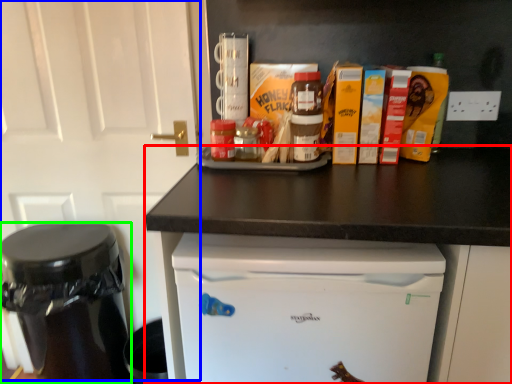
Question: Estimate the real-world distances between objects in this image. Which object is closer to counter (highlighted by a red box), door (highlighted by a blue box) or appliance (highlighted by a green box)?

Choices:
 (A) door
 (B) appliance

Answer: (A)